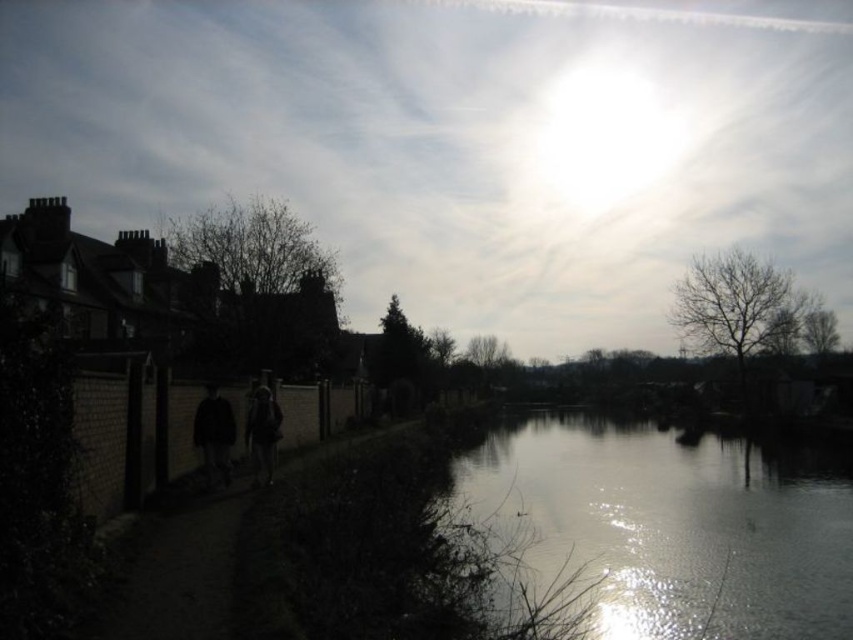
Looking at this image, you are a photographer standing at the riverside and see two dark items at the center of the image. Which one is nearer to you, the dark matte clothing at center or the dark fabric jacket at center?

The dark matte clothing at center is closer to the viewer than the dark fabric jacket at center.

You are standing at the riverside and want to take a photo of the silvery reflective water at center and the dark matte clothing at center. Which object should you focus on first to ensure both are in focus?

You should focus on the dark matte clothing at center first because it is farther away from the viewer than the silvery reflective water at center. By focusing on the farther object, you can ensure both are in focus within the depth of field.